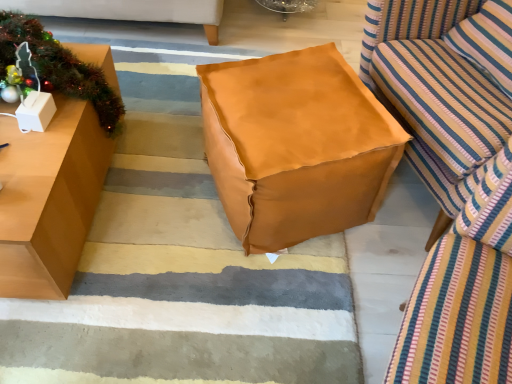
The height and width of the screenshot is (384, 512). I want to click on vacant space situated on the left part of leather-like tan bean bag at center, so click(x=158, y=187).